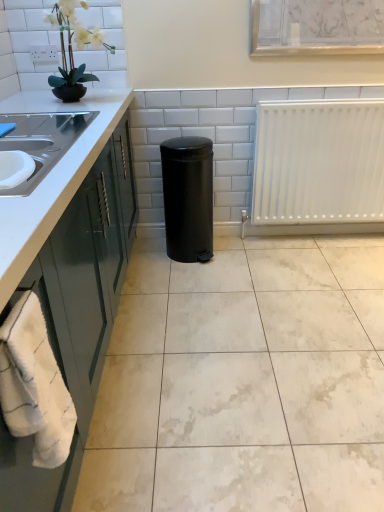
Locate an element on the screen. The image size is (384, 512). vacant space underneath white matte radiator at right (from a real-world perspective) is located at coordinates (336, 233).